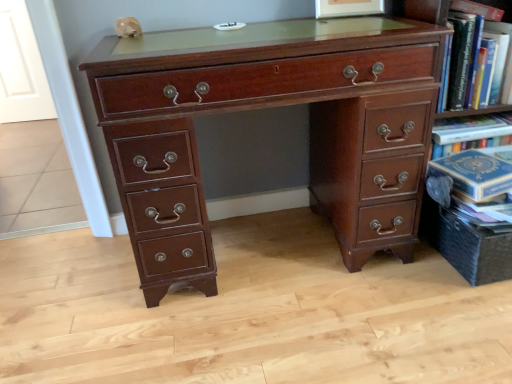
Question: Is hardcover book at upper right to the right of mahogany wood desk at center from the viewer's perspective?

Choices:
 (A) yes
 (B) no

Answer: (A)

Question: Is hardcover book at upper right positioned before mahogany wood desk at center?

Choices:
 (A) no
 (B) yes

Answer: (A)

Question: Does hardcover book at upper right come behind mahogany wood desk at center?

Choices:
 (A) no
 (B) yes

Answer: (B)

Question: Considering the relative sizes of hardcover book at upper right and mahogany wood desk at center in the image provided, is hardcover book at upper right taller than mahogany wood desk at center?

Choices:
 (A) no
 (B) yes

Answer: (A)

Question: Can you confirm if hardcover book at upper right is positioned to the left of mahogany wood desk at center?

Choices:
 (A) yes
 (B) no

Answer: (B)

Question: Does hardcover book at upper right have a lesser height compared to mahogany wood desk at center?

Choices:
 (A) no
 (B) yes

Answer: (B)

Question: Can you confirm if mahogany wood desk at center is taller than hardcover book at upper right?

Choices:
 (A) no
 (B) yes

Answer: (B)

Question: From a real-world perspective, is mahogany wood desk at center positioned under hardcover book at upper right based on gravity?

Choices:
 (A) no
 (B) yes

Answer: (B)

Question: From the image's perspective, is mahogany wood desk at center above hardcover book at upper right?

Choices:
 (A) no
 (B) yes

Answer: (A)

Question: From a real-world perspective, is mahogany wood desk at center on hardcover book at upper right?

Choices:
 (A) yes
 (B) no

Answer: (B)

Question: Is mahogany wood desk at center outside hardcover book at upper right?

Choices:
 (A) no
 (B) yes

Answer: (B)

Question: Is mahogany wood desk at center touching hardcover book at upper right?

Choices:
 (A) yes
 (B) no

Answer: (B)

Question: Is mahogany wood desk at center taller or shorter than hardcover book at upper right?

Choices:
 (A) short
 (B) tall

Answer: (B)